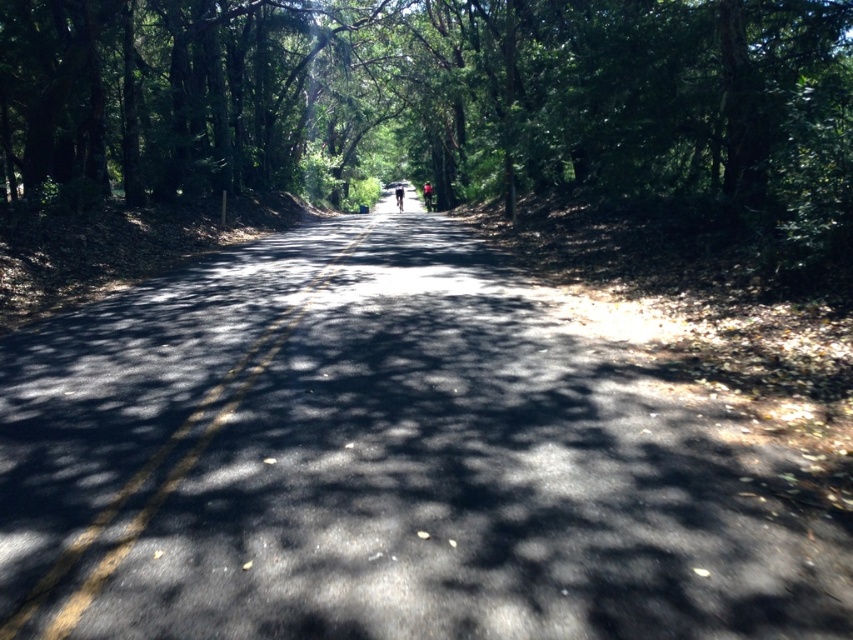
Who is positioned more to the right, green fabric person at center or dark blue fabric umbrella at center?

green fabric person at center is more to the right.

Find the location of a particular element. The image size is (853, 640). green fabric person at center is located at coordinates pyautogui.click(x=427, y=195).

At what (x,y) coordinates should I click in order to perform the action: click on green fabric person at center. Please return your answer as a coordinate pair (x, y). Looking at the image, I should click on (427, 195).

Can you confirm if green leafy trees at center is positioned below dark blue fabric umbrella at center?

Actually, green leafy trees at center is above dark blue fabric umbrella at center.

Describe the element at coordinates (444, 100) in the screenshot. I see `green leafy trees at center` at that location.

Is point (764, 166) positioned after point (402, 192)?

No, it is in front of (402, 192).

Identify the location of green leafy trees at center. This screenshot has height=640, width=853. (444, 100).

Is point (84, 125) closer to camera compared to point (422, 186)?

Yes, it is in front of point (422, 186).

Does green leafy trees at center appear over green fabric person at center?

Indeed, green leafy trees at center is positioned over green fabric person at center.

Describe the element at coordinates (444, 100) in the screenshot. The height and width of the screenshot is (640, 853). I see `green leafy trees at center` at that location.

Image resolution: width=853 pixels, height=640 pixels. Identify the location of green leafy trees at center. (444, 100).